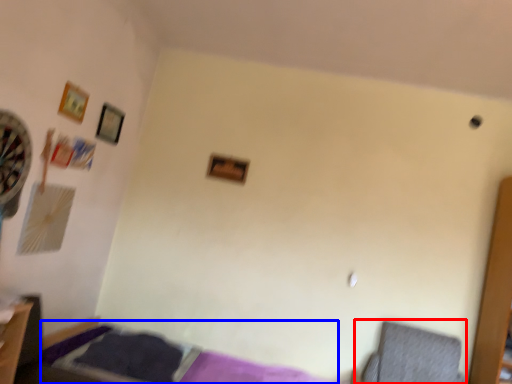
Question: Among these objects, which one is farthest to the camera, swivel chair (highlighted by a red box) or bed (highlighted by a blue box)?

Choices:
 (A) swivel chair
 (B) bed

Answer: (A)